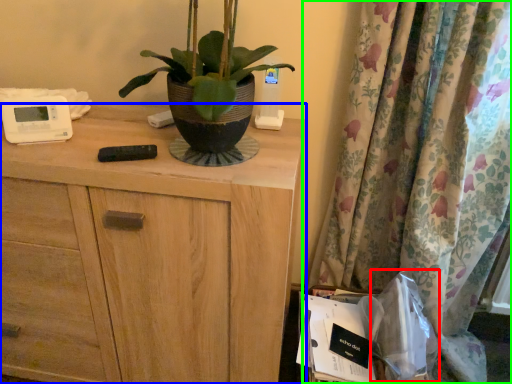
Question: Which object is the farthest from paper bag (highlighted by a red box)? Choose among these: chest of drawers (highlighted by a blue box) or curtain (highlighted by a green box).

Choices:
 (A) chest of drawers
 (B) curtain

Answer: (A)